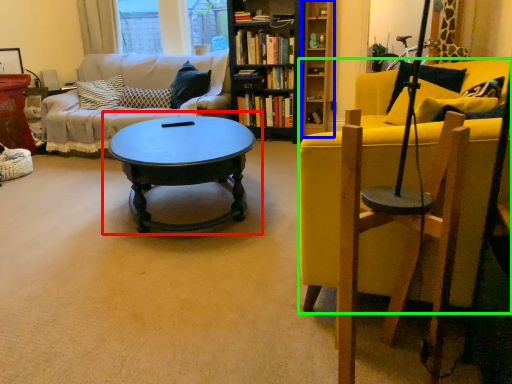
Question: Estimate the real-world distances between objects in this image. Which object is closer to coffee table (highlighted by a red box), shelf (highlighted by a blue box) or chair (highlighted by a green box)?

Choices:
 (A) shelf
 (B) chair

Answer: (B)